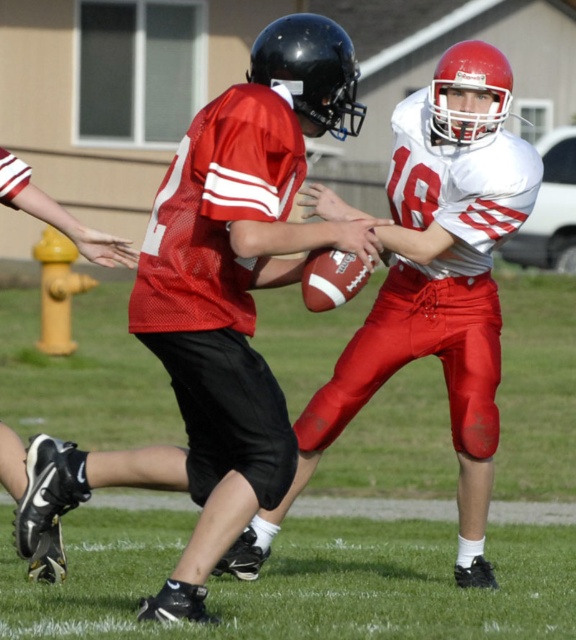
Does point (190, 163) come farther from viewer compared to point (463, 442)?

No, (190, 163) is closer to viewer.

Does matte red football at center have a greater height compared to matte white jersey at center?

No, matte red football at center is not taller than matte white jersey at center.

In order to click on matte red football at center in this screenshot , I will do pyautogui.click(x=236, y=284).

Which is below, green grass football field at center or matte red football at center?

green grass football field at center

Between point (52, 429) and point (14, 531), which one is positioned behind?

Positioned behind is point (52, 429).

At what (x,y) coordinates should I click in order to perform the action: click on green grass football field at center. Please return your answer as a coordinate pair (x, y). Image resolution: width=576 pixels, height=640 pixels. Looking at the image, I should click on (354, 534).

Based on the photo, who is taller, green grass football field at center or matte white jersey at center?

matte white jersey at center is taller.

Does point (528, 636) come behind point (460, 202)?

No, (528, 636) is closer to viewer.

The width and height of the screenshot is (576, 640). What are the coordinates of `green grass football field at center` in the screenshot? It's located at (354, 534).